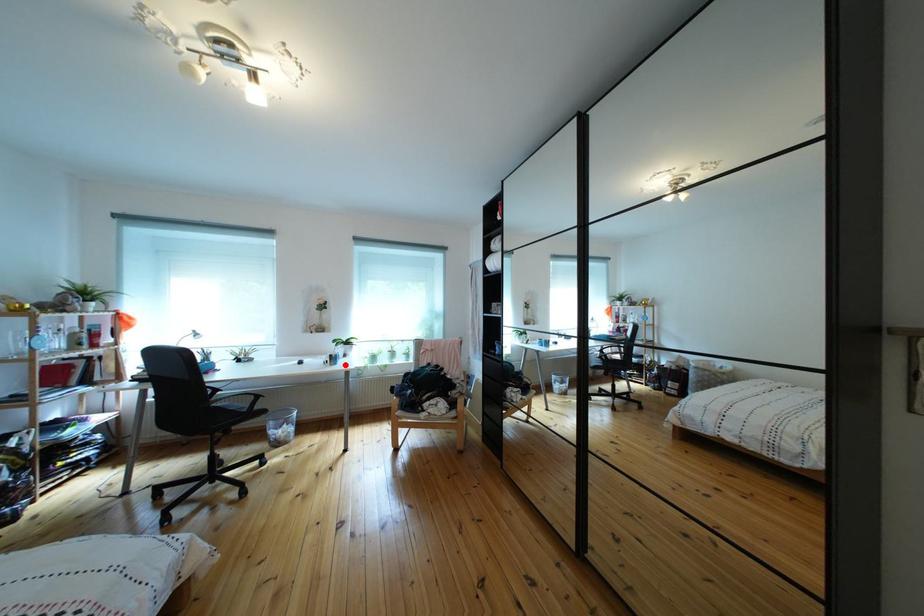
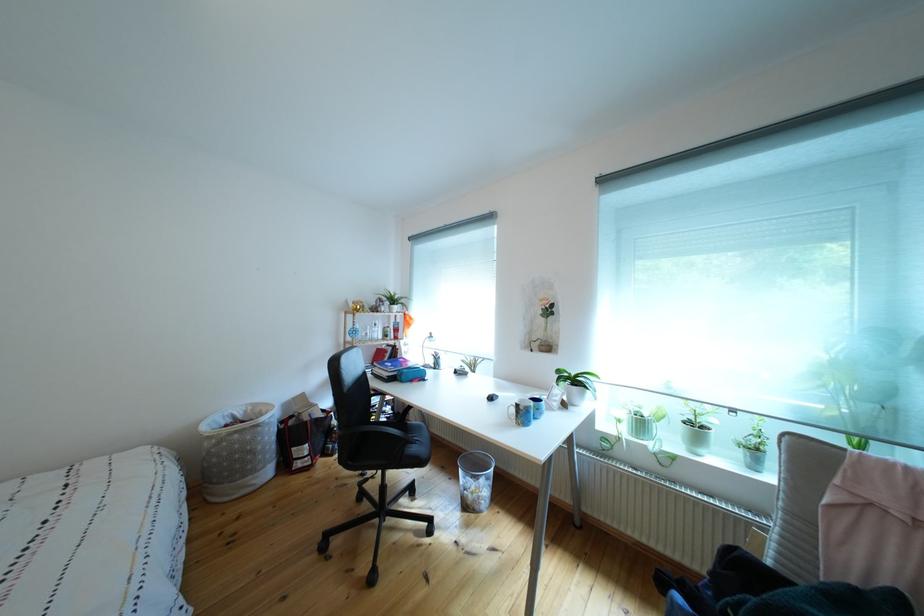
Question: I am providing you with two images of the same scene from different viewpoints. In image1, a red point is highlighted. Considering the same 3D point in image2, which of the following is correct?

Choices:
 (A) It is closer
 (B) It is farther

Answer: (B)